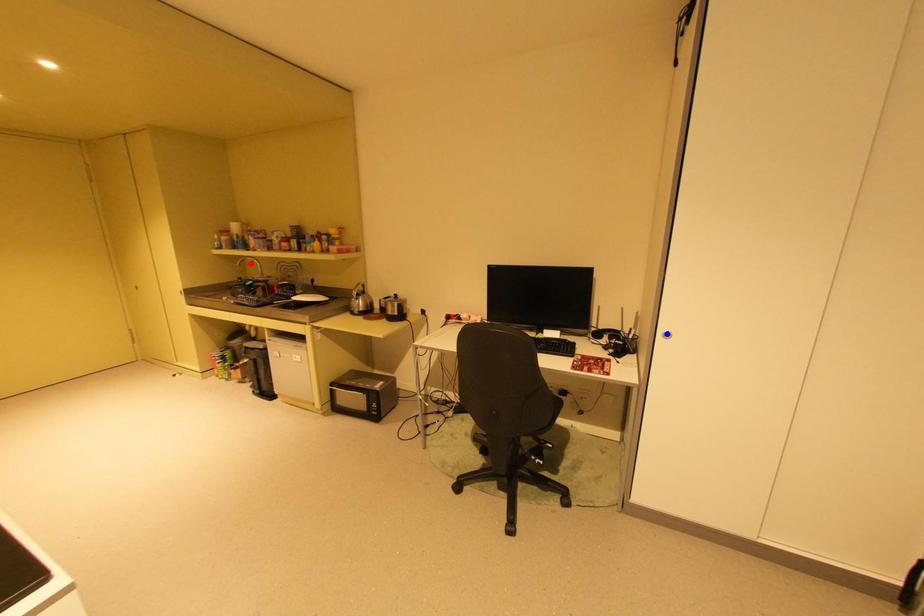
Question: Which of the two points in the image is closer to the camera?

Choices:
 (A) Blue point is closer.
 (B) Red point is closer.

Answer: (A)